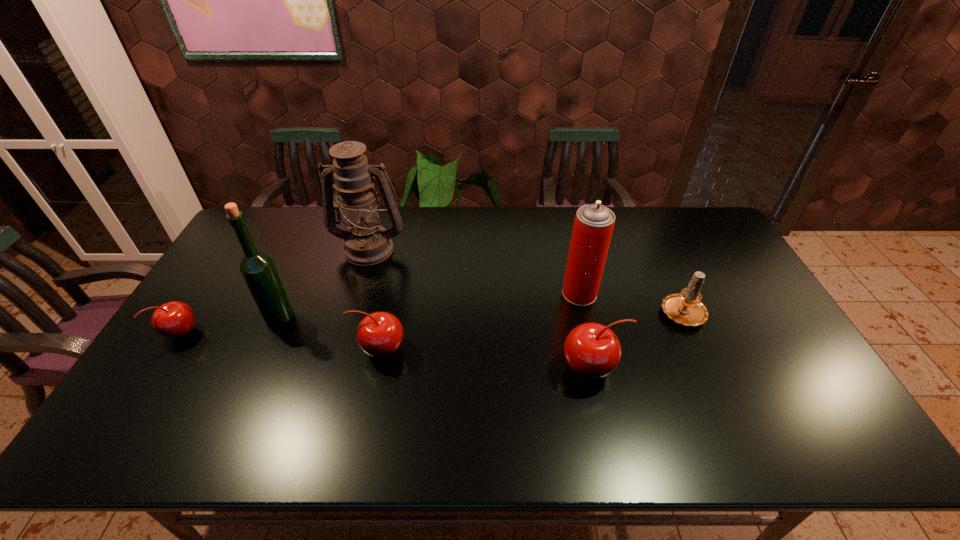
Where is `the leftmost cherry`? This screenshot has height=540, width=960. the leftmost cherry is located at coordinates (174, 319).

You are a GUI agent. You are given a task and a screenshot of the screen. Output one action in this format:
    pyautogui.click(x=<x>, y=<y>)
    Task: Click on the shortest object
    Image resolution: width=960 pixels, height=540 pixels.
    Given the screenshot: What is the action you would take?
    pyautogui.click(x=174, y=319)

The image size is (960, 540). I want to click on the second shortest cherry, so click(x=379, y=334).

Find the location of `the rightmost cherry`. the rightmost cherry is located at coordinates (592, 351).

What are the coordinates of `oil lamp` in the screenshot? It's located at (367, 243).

At what (x,y) coordinates should I click in order to perform the action: click on candle. Please return your answer as a coordinate pair (x, y). The height and width of the screenshot is (540, 960). Looking at the image, I should click on pos(685,308).

Find the location of `the fifth shortest object`. the fifth shortest object is located at coordinates (593, 226).

You are a GUI agent. You are given a task and a screenshot of the screen. Output one action in this format:
    pyautogui.click(x=<x>, y=<y>)
    Task: Click on the liquor
    This screenshot has height=540, width=960.
    Given the screenshot: What is the action you would take?
    pyautogui.click(x=257, y=268)

This screenshot has height=540, width=960. I want to click on vacant region located 0.100m on the right of the shortest cherry, so tap(235, 333).

Find the location of a particular element. vacant space located on the back of the second cherry from left to right is located at coordinates (401, 246).